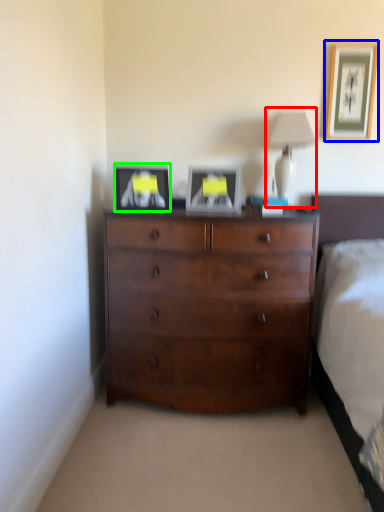
Question: Which object is positioned closest to table lamp (highlighted by a red box)? Select from picture frame (highlighted by a blue box) and picture frame (highlighted by a green box).

Choices:
 (A) picture frame
 (B) picture frame

Answer: (A)